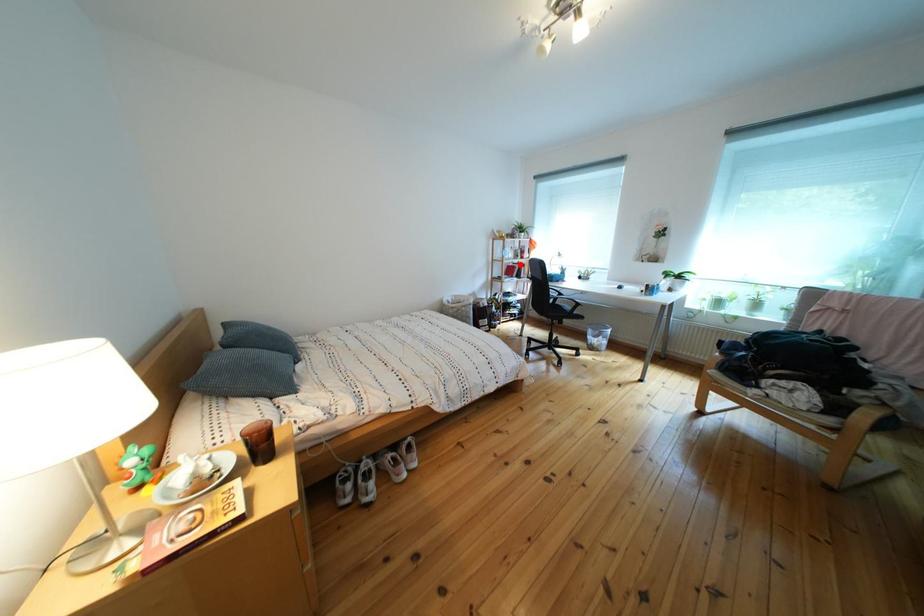
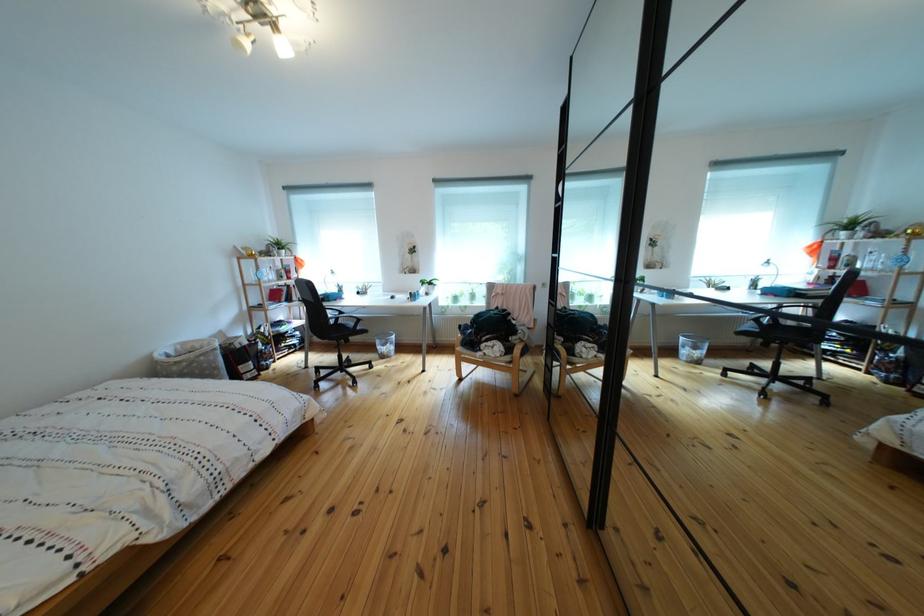
Question: I am providing you with two images of the same scene from different viewpoints. A red point is shown in image1. For the corresponding object point in image2, is it positioned nearer or farther from the camera?

Choices:
 (A) Nearer
 (B) Farther

Answer: (B)